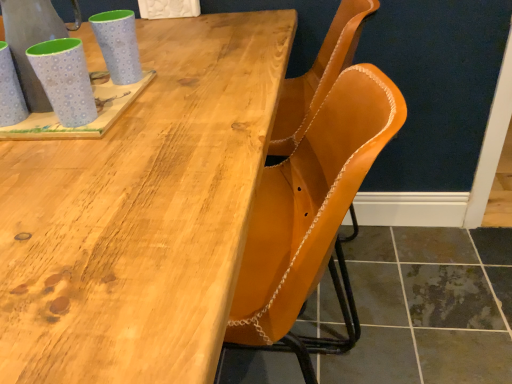
Question: Is matte blue mug at left, acting as the 1th mug starting from the left, smaller than matte blue mug at upper left, marked as the second mug in a left-to-right arrangement?

Choices:
 (A) no
 (B) yes

Answer: (A)

Question: Can you confirm if matte blue mug at left, acting as the 1th mug starting from the left, is taller than matte blue mug at upper left, marked as the second mug in a left-to-right arrangement?

Choices:
 (A) no
 (B) yes

Answer: (B)

Question: Considering the relative sizes of matte blue mug at left, acting as the third mug starting from the right, and matte blue mug at upper left, marked as the second mug in a left-to-right arrangement, in the image provided, is matte blue mug at left, acting as the third mug starting from the right, wider than matte blue mug at upper left, marked as the second mug in a left-to-right arrangement,?

Choices:
 (A) no
 (B) yes

Answer: (B)

Question: Is matte blue mug at left, acting as the third mug starting from the right, oriented towards matte blue mug at upper left, marked as the second mug in a left-to-right arrangement?

Choices:
 (A) no
 (B) yes

Answer: (A)

Question: From a real-world perspective, is matte blue mug at left, acting as the 1th mug starting from the left, on top of matte blue mug at upper left, the 2th mug positioned from the right?

Choices:
 (A) no
 (B) yes

Answer: (B)

Question: Is matte blue mug at left, acting as the 1th mug starting from the left, looking in the opposite direction of matte blue mug at upper left, marked as the second mug in a left-to-right arrangement?

Choices:
 (A) no
 (B) yes

Answer: (A)

Question: Is the position of brushed metal pitcher at upper left more distant than that of matte blue mug at upper left, which ranks as the 1th mug in right-to-left order?

Choices:
 (A) no
 (B) yes

Answer: (A)

Question: From the image's perspective, would you say brushed metal pitcher at upper left is shown under matte blue mug at upper left, which is the 3th mug in left-to-right order?

Choices:
 (A) no
 (B) yes

Answer: (B)

Question: Does brushed metal pitcher at upper left have a larger size compared to matte blue mug at upper left, which ranks as the 1th mug in right-to-left order?

Choices:
 (A) no
 (B) yes

Answer: (B)

Question: From the image's perspective, would you say brushed metal pitcher at upper left is positioned over matte blue mug at upper left, which is the 3th mug in left-to-right order?

Choices:
 (A) yes
 (B) no

Answer: (B)

Question: Can you confirm if brushed metal pitcher at upper left is shorter than matte blue mug at upper left, which ranks as the 1th mug in right-to-left order?

Choices:
 (A) no
 (B) yes

Answer: (A)

Question: Considering the relative sizes of brushed metal pitcher at upper left and matte blue mug at upper left, which ranks as the 1th mug in right-to-left order, in the image provided, is brushed metal pitcher at upper left taller than matte blue mug at upper left, which ranks as the 1th mug in right-to-left order,?

Choices:
 (A) yes
 (B) no

Answer: (A)

Question: From a real-world perspective, is matte blue mug at upper left, marked as the second mug in a left-to-right arrangement, positioned under leather at center based on gravity?

Choices:
 (A) no
 (B) yes

Answer: (A)